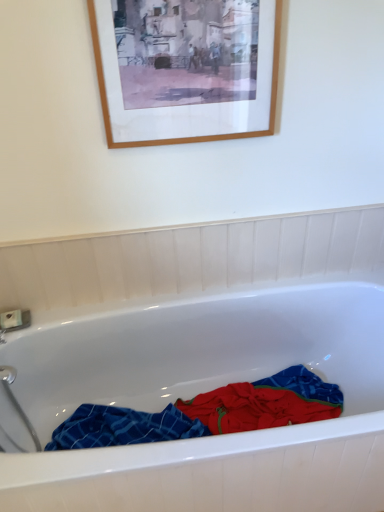
At what (x,y) coordinates should I click in order to perform the action: click on white glossy bathtub at center. Please return your answer as a coordinate pair (x, y). The image size is (384, 512). Looking at the image, I should click on pos(201,392).

Describe the element at coordinates (206, 413) in the screenshot. I see `blue plaid towel at center` at that location.

The width and height of the screenshot is (384, 512). Find the location of `white glossy bathtub at center`. white glossy bathtub at center is located at coordinates (201, 392).

Considering their positions, is wooden picture frame at upper center located in front of or behind white glossy bathtub at center?

In the image, wooden picture frame at upper center appears behind white glossy bathtub at center.

Is wooden picture frame at upper center inside the boundaries of white glossy bathtub at center, or outside?

wooden picture frame at upper center lies outside white glossy bathtub at center.

Based on their sizes in the image, would you say wooden picture frame at upper center is bigger or smaller than white glossy bathtub at center?

Clearly, wooden picture frame at upper center is smaller in size than white glossy bathtub at center.

Consider the image. Does wooden picture frame at upper center have a lesser width compared to white glossy bathtub at center?

Yes.

Which of these two, blue plaid towel at center or wooden picture frame at upper center, is smaller?

Answer: wooden picture frame at upper center.

Which is farther, [337,401] or [200,111]?

The point [337,401] is more distant.

Based on their positions, is blue plaid towel at center located to the left or right of wooden picture frame at upper center?

blue plaid towel at center is to the right of wooden picture frame at upper center.

Consider the image. From the image's perspective, which is above, blue plaid towel at center or wooden picture frame at upper center?

wooden picture frame at upper center, from the image's perspective.

Can you confirm if white glossy bathtub at center is positioned to the right of blue plaid towel at center?

Yes, white glossy bathtub at center is to the right of blue plaid towel at center.

Would you consider white glossy bathtub at center to be distant from blue plaid towel at center?

No, white glossy bathtub at center is not far from blue plaid towel at center.

Between point (13, 410) and point (326, 400), which one is positioned behind?

Positioned behind is point (326, 400).

Would you say blue plaid towel at center is part of white glossy bathtub at center's contents?

Yes.

Which is in front, white glossy bathtub at center or wooden picture frame at upper center?

Positioned in front is white glossy bathtub at center.

Considering the sizes of objects white glossy bathtub at center and wooden picture frame at upper center in the image provided, who is thinner, white glossy bathtub at center or wooden picture frame at upper center?

wooden picture frame at upper center is thinner.

From a real-world perspective, is white glossy bathtub at center under wooden picture frame at upper center?

Yes, from a real-world perspective, white glossy bathtub at center is beneath wooden picture frame at upper center.

Considering the positions of objects white glossy bathtub at center and wooden picture frame at upper center in the image provided, who is more to the right, white glossy bathtub at center or wooden picture frame at upper center?

From the viewer's perspective, white glossy bathtub at center appears more on the right side.

From the image's perspective, does blue plaid towel at center appear higher than white glossy bathtub at center?

Actually, blue plaid towel at center appears below white glossy bathtub at center in the image.

Considering the positions of point (237, 392) and point (221, 312), is point (237, 392) closer or farther from the camera than point (221, 312)?

Clearly, point (237, 392) is more distant from the camera than point (221, 312).

Can you confirm if blue plaid towel at center is bigger than white glossy bathtub at center?

Incorrect, blue plaid towel at center is not larger than white glossy bathtub at center.

Are blue plaid towel at center and white glossy bathtub at center located far from each other?

blue plaid towel at center is actually quite close to white glossy bathtub at center.

Considering the sizes of wooden picture frame at upper center and blue plaid towel at center in the image, is wooden picture frame at upper center wider or thinner than blue plaid towel at center?

wooden picture frame at upper center is thinner than blue plaid towel at center.

Could you tell me if wooden picture frame at upper center is turned towards blue plaid towel at center?

No, wooden picture frame at upper center is not facing towards blue plaid towel at center.

From a real-world perspective, who is located higher, wooden picture frame at upper center or blue plaid towel at center?

In real-world perspective, wooden picture frame at upper center is above.

Is point (135, 119) closer or farther from the camera than point (99, 407)?

Point (135, 119) appears to be closer to the viewer than point (99, 407).

Image resolution: width=384 pixels, height=512 pixels. What are the coordinates of `bathtub that appears in front of the wooden picture frame at upper center` in the screenshot? It's located at (201, 392).

At what (x,y) coordinates should I click in order to perform the action: click on material to the right of wooden picture frame at upper center. Please return your answer as a coordinate pair (x, y). Looking at the image, I should click on (206, 413).

From the image, which object appears to be farther from white glossy bathtub at center, wooden picture frame at upper center or blue plaid towel at center?

Among the two, wooden picture frame at upper center is located further to white glossy bathtub at center.

When comparing their distances from white glossy bathtub at center, does blue plaid towel at center or wooden picture frame at upper center seem further?

Based on the image, wooden picture frame at upper center appears to be further to white glossy bathtub at center.

Looking at the image, which one is located further to blue plaid towel at center, wooden picture frame at upper center or white glossy bathtub at center?

Among the two, wooden picture frame at upper center is located further to blue plaid towel at center.

From the image, which object appears to be farther from wooden picture frame at upper center, blue plaid towel at center or white glossy bathtub at center?

Among the two, blue plaid towel at center is located further to wooden picture frame at upper center.

Based on their spatial positions, is white glossy bathtub at center or blue plaid towel at center further from wooden picture frame at upper center?

Among the two, blue plaid towel at center is located further to wooden picture frame at upper center.

Estimate the real-world distances between objects in this image. Which object is closer to blue plaid towel at center, white glossy bathtub at center or wooden picture frame at upper center?

white glossy bathtub at center is positioned closer to the anchor blue plaid towel at center.

Find the location of a particular element. bathtub between wooden picture frame at upper center and blue plaid towel at center in the up-down direction is located at coordinates (201, 392).